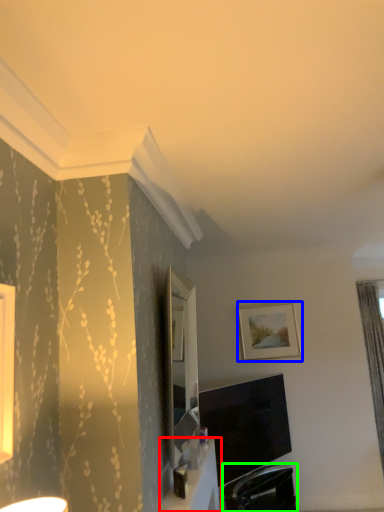
Question: Which is nearer to the table (highlighted by a red box)? picture frame (highlighted by a blue box) or swivel chair (highlighted by a green box).

Choices:
 (A) picture frame
 (B) swivel chair

Answer: (B)